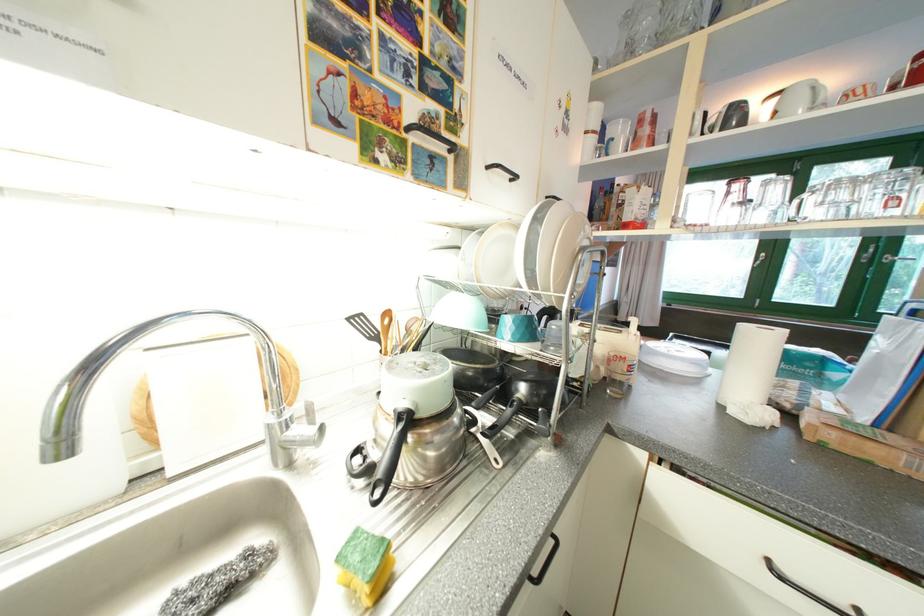
This screenshot has width=924, height=616. I want to click on pot lid handle, so click(390, 456).